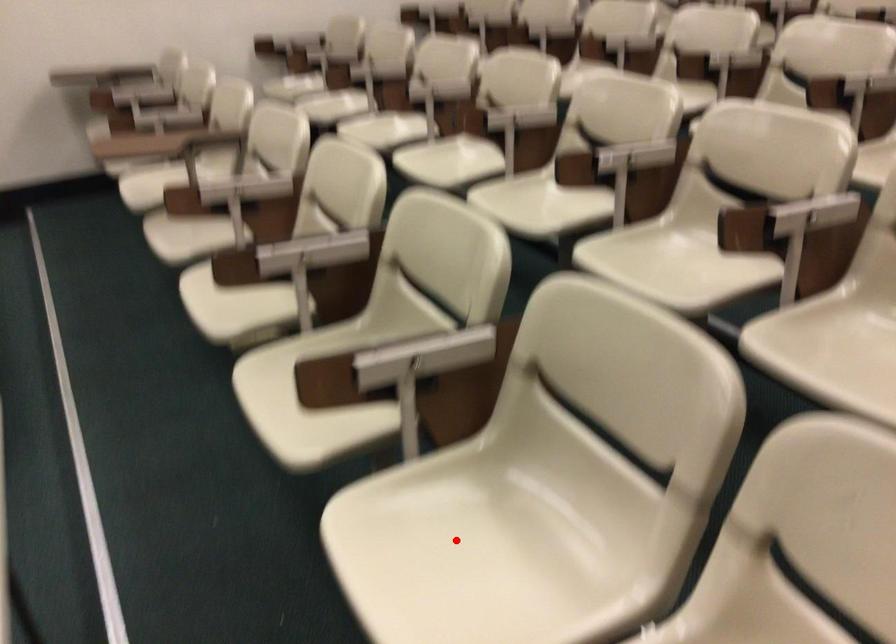
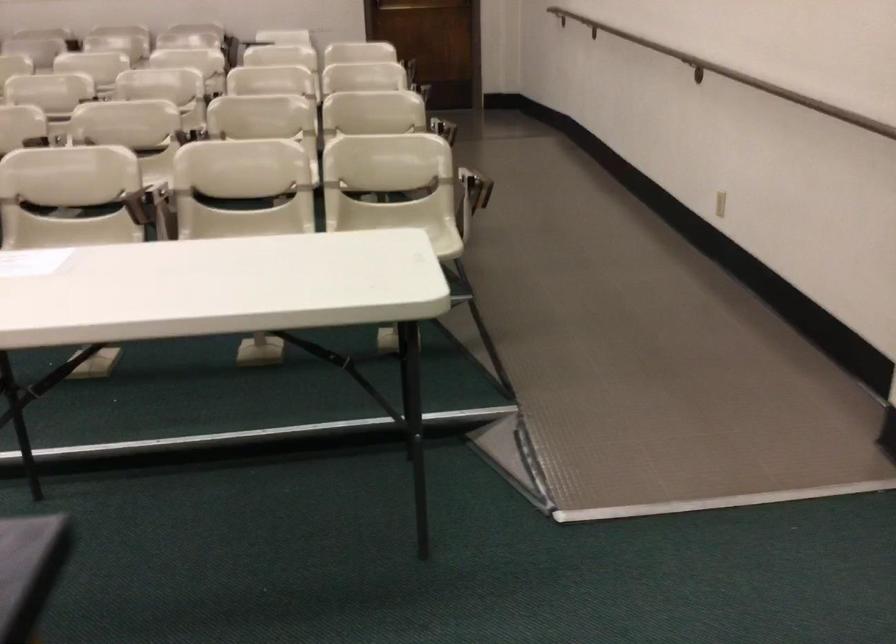
Question: I am providing you with two images of the same scene from different viewpoints. A red point is marked on the first image. Is the red point's position out of view in image 2?

Choices:
 (A) Yes
 (B) No

Answer: (A)